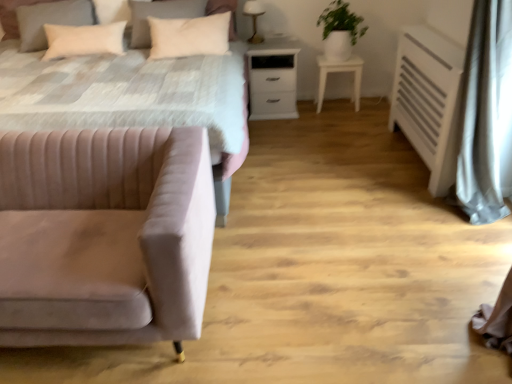
This screenshot has width=512, height=384. I want to click on vacant space to the left of white sheer curtain at right, so point(425,231).